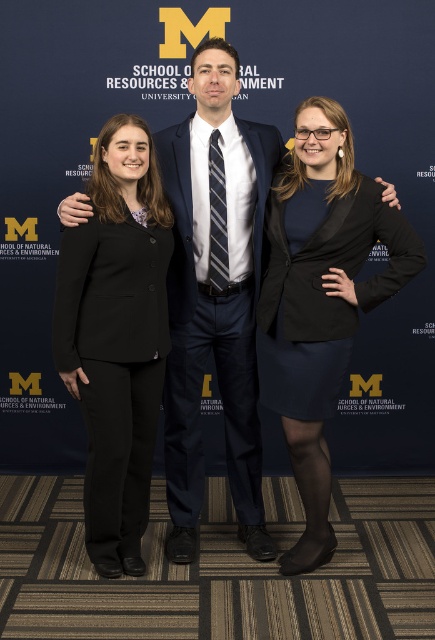
Between black wool business suit at left and navy blue fabric business suit at center, which one appears on the left side from the viewer's perspective?

Positioned to the left is black wool business suit at left.

Does point (73, 326) lie in front of point (177, 333)?

Yes, it is in front of point (177, 333).

This screenshot has width=435, height=640. I want to click on black wool business suit at left, so click(114, 365).

Where is `black wool business suit at left`? This screenshot has height=640, width=435. black wool business suit at left is located at coordinates (114, 365).

Is point (313, 237) farther from camera compared to point (174, 440)?

No.

At what (x,y) coordinates should I click in order to perform the action: click on matte black blazer at center. Please return your answer as a coordinate pair (x, y). The height and width of the screenshot is (640, 435). Looking at the image, I should click on (321, 300).

Is matte black suit at center bigger than matte black blazer at center?

Yes, matte black suit at center is bigger than matte black blazer at center.

This screenshot has height=640, width=435. Describe the element at coordinates (214, 292) in the screenshot. I see `matte black suit at center` at that location.

Locate an element on the screen. matte black suit at center is located at coordinates (214, 292).